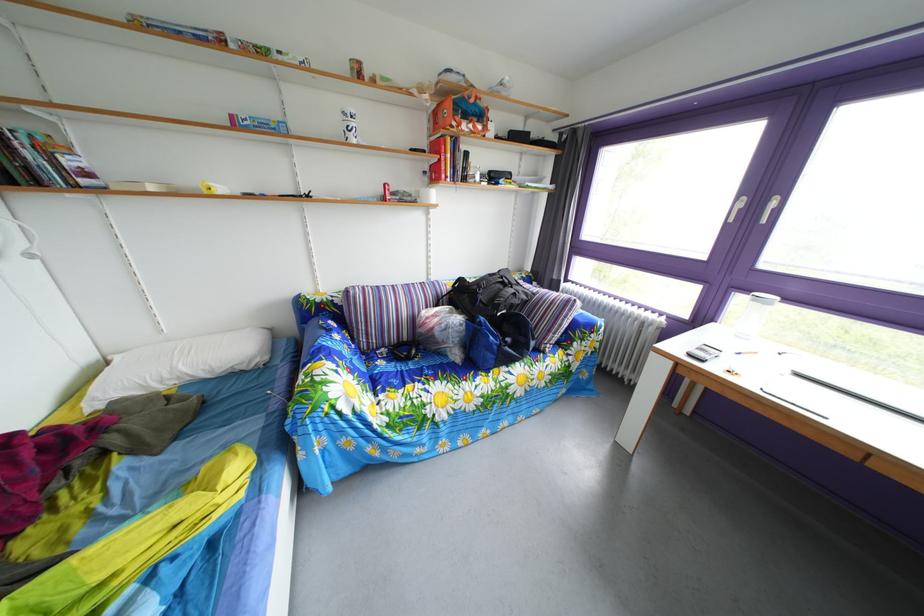
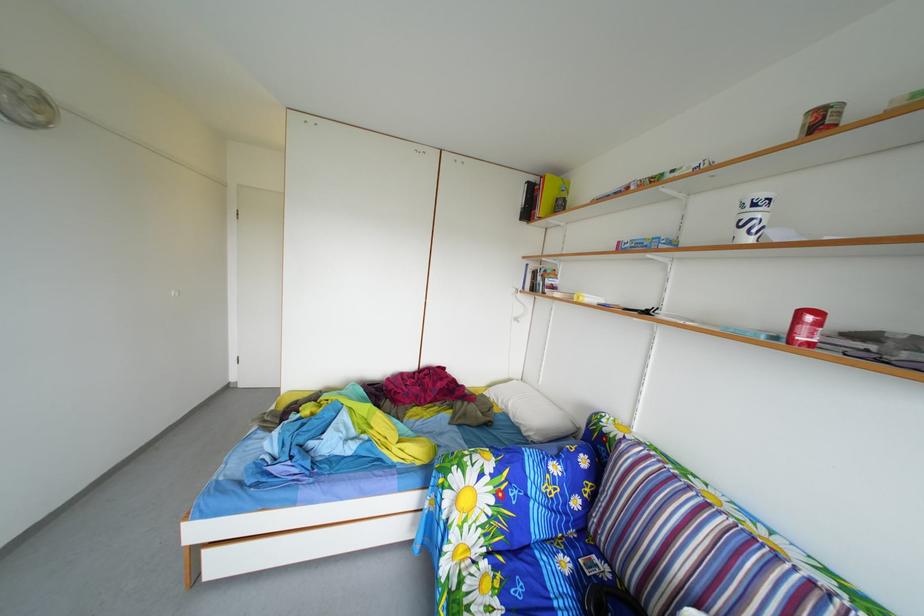
Where in the second image is the point corresponding to (x=391, y=371) from the first image?

(576, 570)